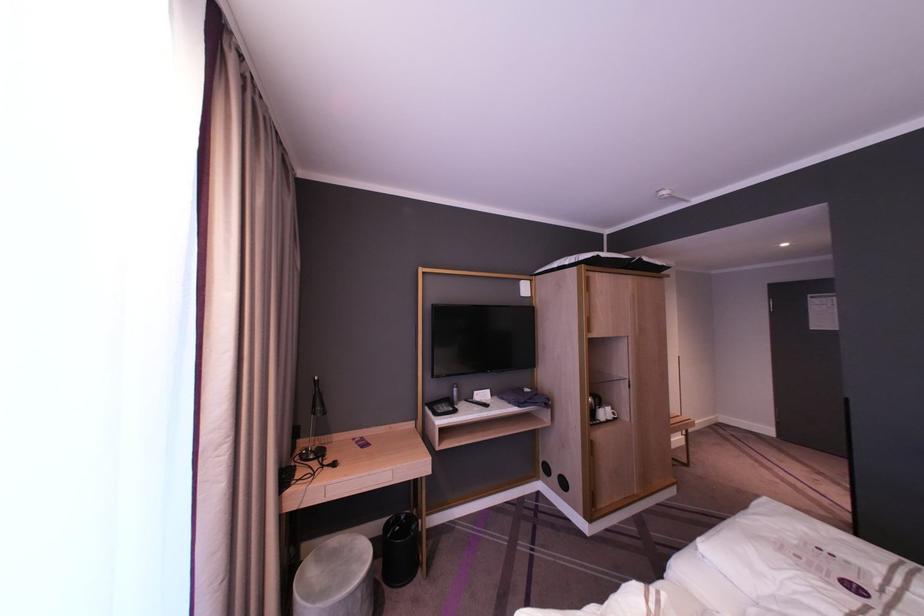
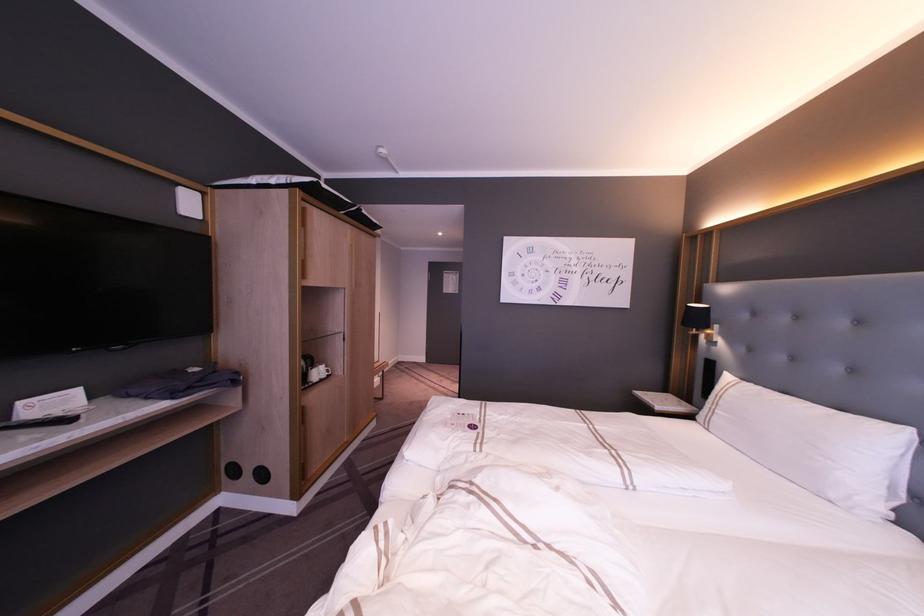
Where in the second image is the point corresponding to point (613, 413) from the first image?

(326, 370)